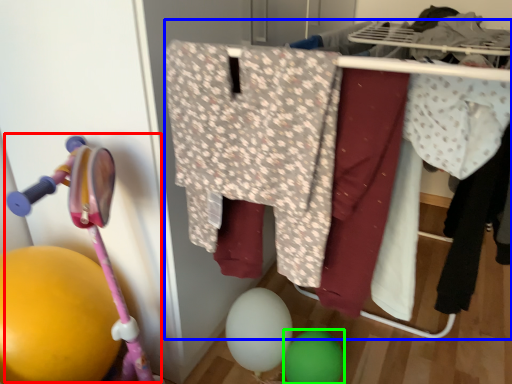
Question: Estimate the real-world distances between objects in this image. Which object is farther from baby carriage (highlighted by a red box), closet (highlighted by a blue box) or balloon (highlighted by a green box)?

Choices:
 (A) closet
 (B) balloon

Answer: (B)